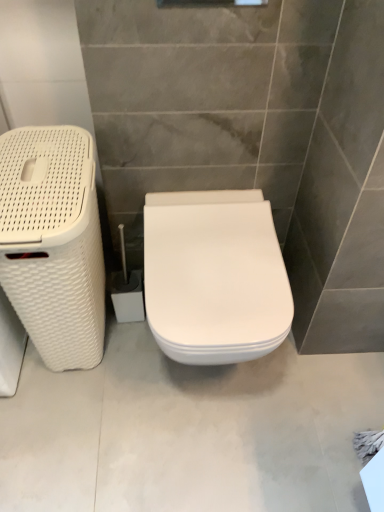
I want to click on free space above white glossy toilet at center (from a real-world perspective), so click(x=203, y=404).